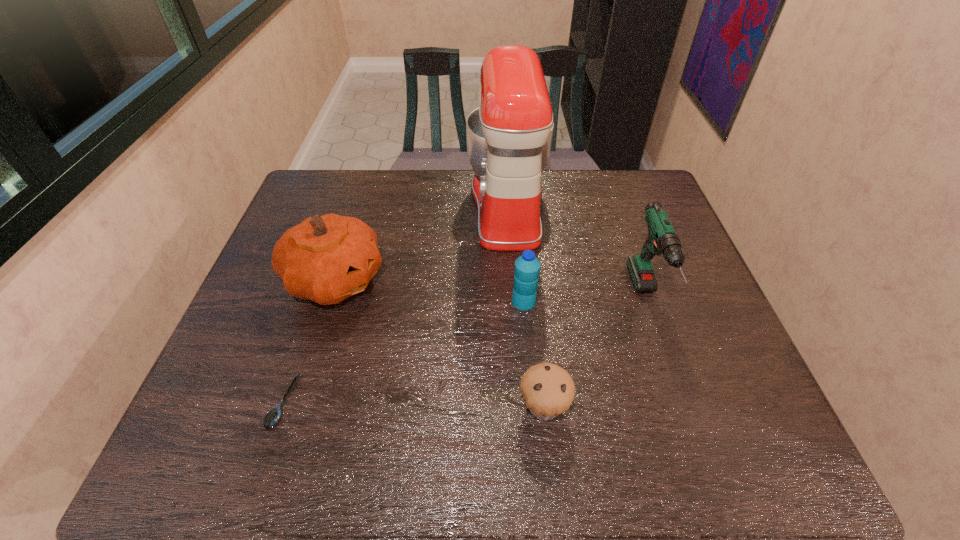
Find the location of a particular element. This screenshot has height=540, width=960. vacant region that satisfies the following two spatial constraints: 1. on the front-facing side of the tallest object; 2. on the left side of the fifth tallest object is located at coordinates (522, 407).

This screenshot has height=540, width=960. Identify the location of free location that satisfies the following two spatial constraints: 1. on the front-facing side of the mixer; 2. on the front side of the soupspoon. (521, 403).